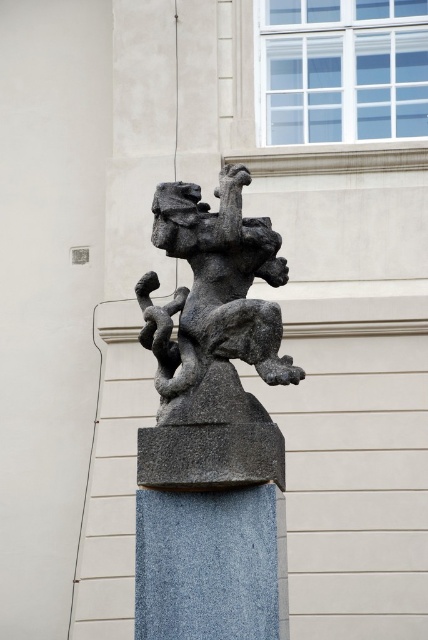
Who is shorter, granite statue at center or gray stone pillar at center?

Standing shorter between the two is gray stone pillar at center.

Who is more forward, (282, 472) or (148, 556)?

Point (148, 556)

The image size is (428, 640). Describe the element at coordinates (213, 342) in the screenshot. I see `granite statue at center` at that location.

The height and width of the screenshot is (640, 428). What are the coordinates of `granite statue at center` in the screenshot? It's located at (213, 342).